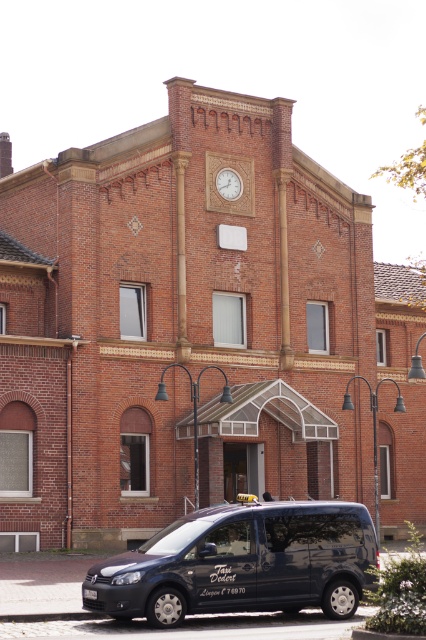
Which of these two, matte black van at lower center or wooden clock at upper center, stands taller?

Standing taller between the two is matte black van at lower center.

Which is behind, point (356, 602) or point (233, 172)?

The point (233, 172) is behind.

Between point (330, 582) and point (230, 173), which one is positioned in front?

Positioned in front is point (330, 582).

At what (x,y) coordinates should I click in order to perform the action: click on matte black van at lower center. Please return your answer as a coordinate pair (x, y). This screenshot has height=640, width=426. Looking at the image, I should click on (241, 563).